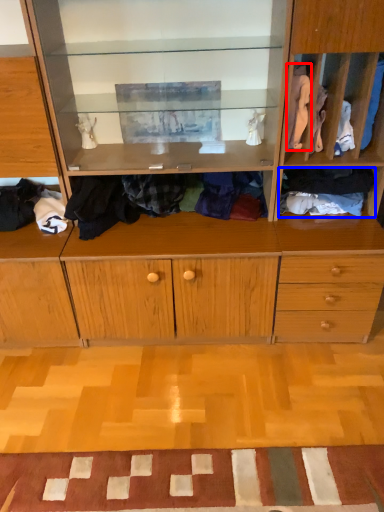
Question: Among these objects, which one is farthest to the camera, clothing (highlighted by a red box) or clothing (highlighted by a blue box)?

Choices:
 (A) clothing
 (B) clothing

Answer: (B)